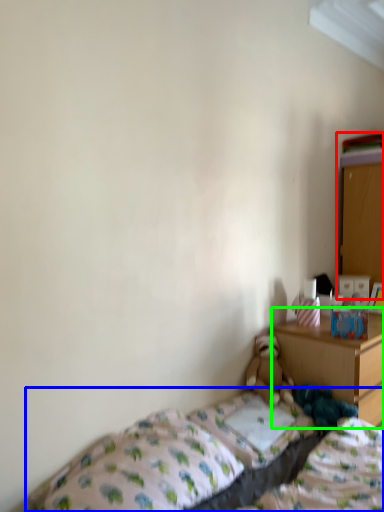
Question: Which object is the closest to the dresser (highlighted by a red box)? Choose among these: bed (highlighted by a blue box) or nightstand (highlighted by a green box).

Choices:
 (A) bed
 (B) nightstand

Answer: (B)